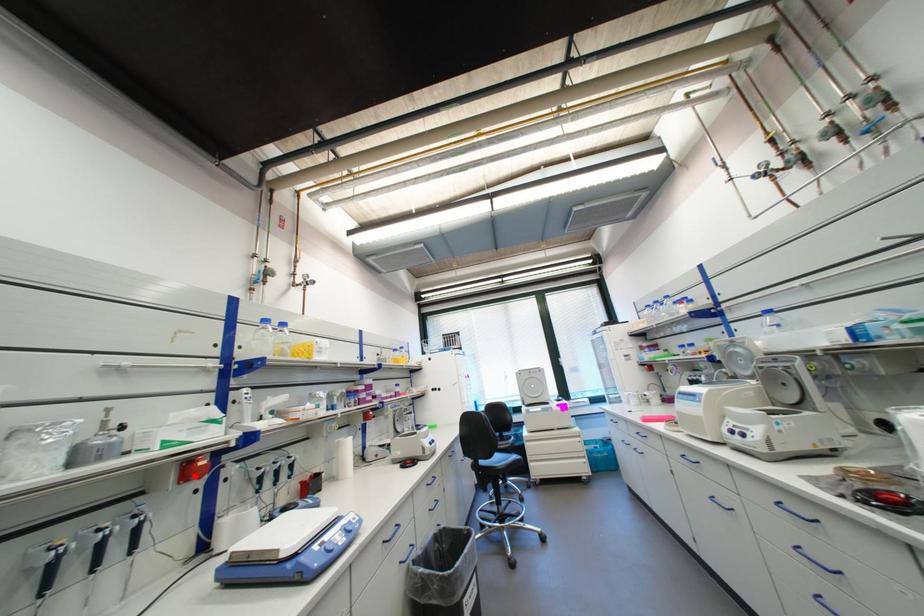
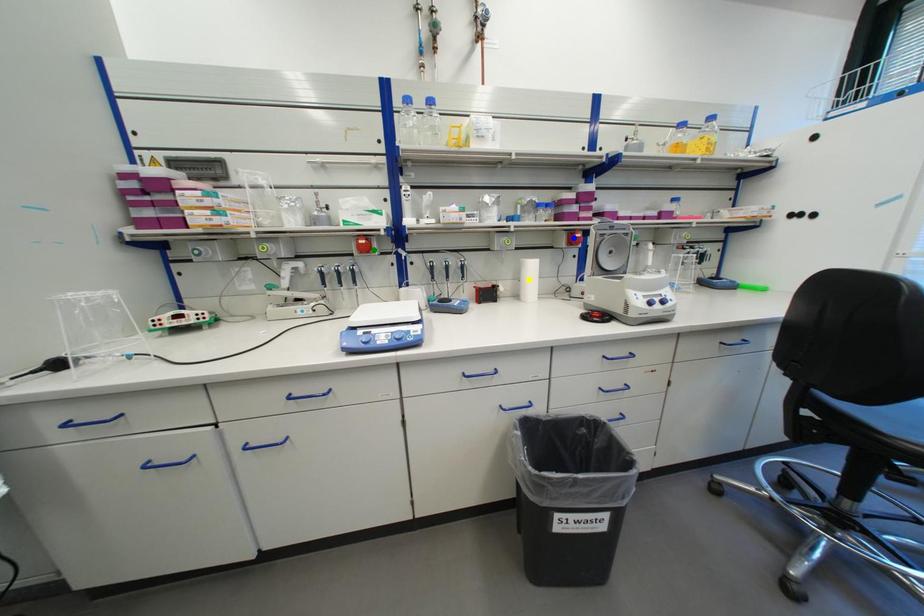
Question: I am providing you with two images of the same scene from different viewpoints. A red point is marked on the first image. You are given multiple points on the second image. In image 2, which mark is for the same physical point as the one in image 1?

Choices:
 (A) yellow point
 (B) green point
 (C) blue point

Answer: (B)